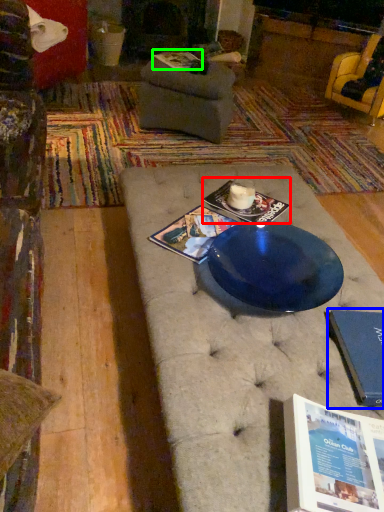
Question: Estimate the real-world distances between objects in this image. Which object is farther from magazine (highlighted by a red box), paperback book (highlighted by a blue box) or magazine (highlighted by a green box)?

Choices:
 (A) paperback book
 (B) magazine

Answer: (B)